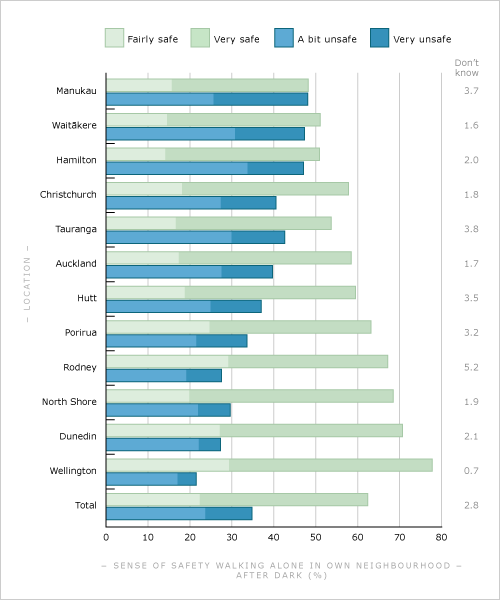
The image size is (500, 600). In order to click on corners in this screenshot , I will do `click(6, 591)`, `click(484, 593)`, `click(8, 22)`, `click(486, 13)`.